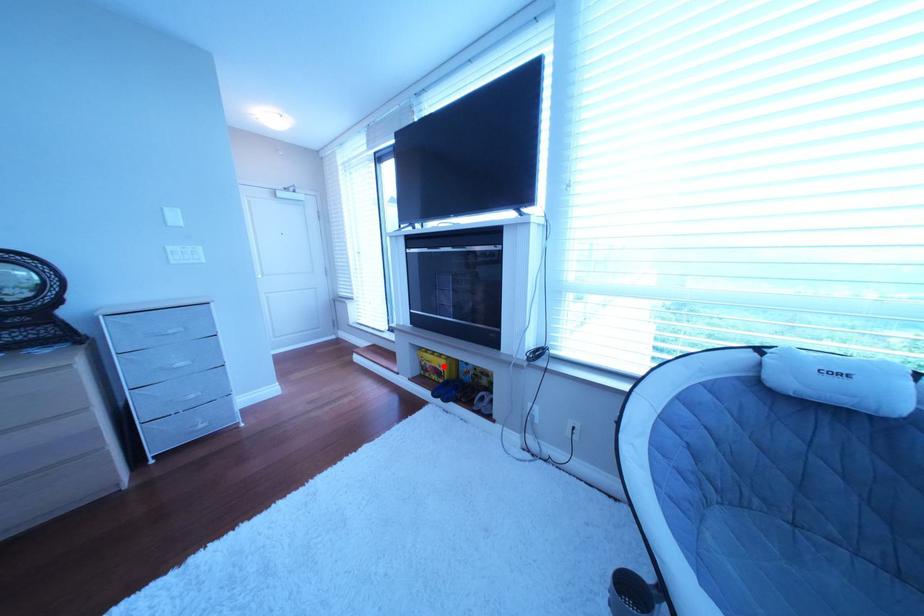
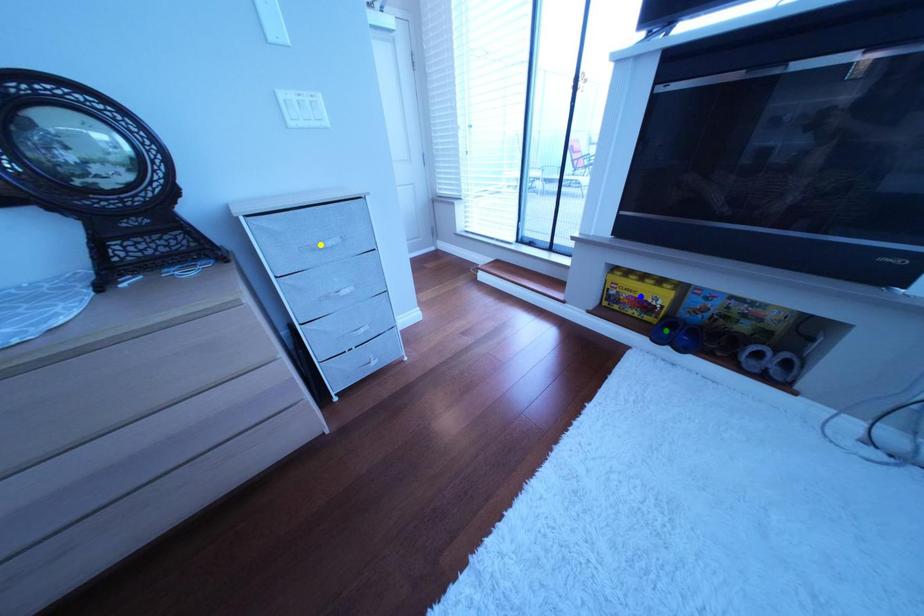
Question: I am providing you with two images of the same scene from different viewpoints. A red point is marked on the first image. You are given multiple points on the second image. Which mark in image 2 goes with the point in image 1?

Choices:
 (A) blue point
 (B) yellow point
 (C) green point

Answer: (A)